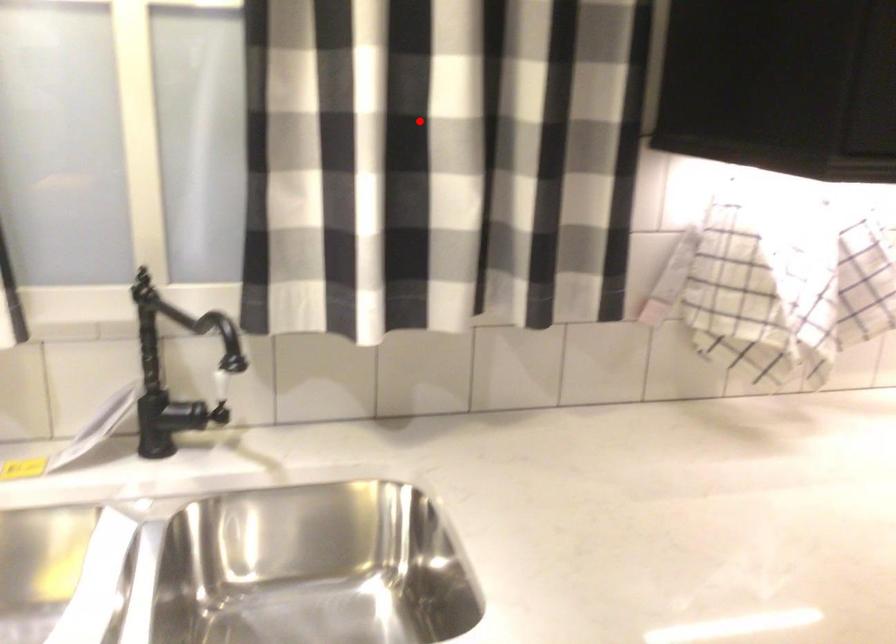
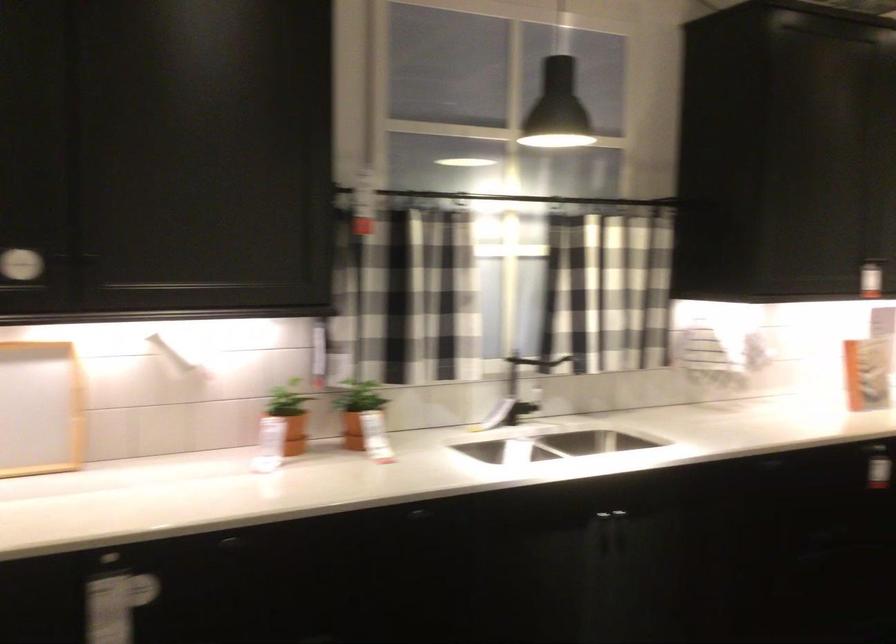
In the second image, find the point that corresponds to the highlighted location in the first image.

(607, 286)